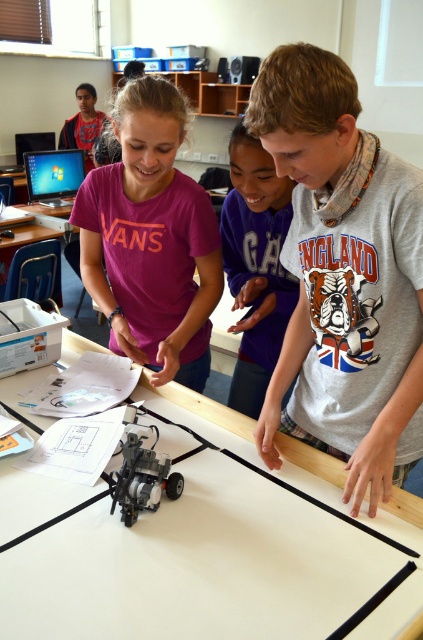
Question: Can you confirm if gray cotton shirt at center is bigger than matte pink shirt at center?

Choices:
 (A) yes
 (B) no

Answer: (B)

Question: Which point is closer to the camera taking this photo?

Choices:
 (A) (239, 284)
 (B) (184, 508)

Answer: (B)

Question: Is white matte table at center to the right of gray cotton shirt at center from the viewer's perspective?

Choices:
 (A) yes
 (B) no

Answer: (B)

Question: Which object is closer to the camera taking this photo?

Choices:
 (A) gray cotton shirt at center
 (B) matte pink shirt at center

Answer: (A)

Question: Which point is farther to the camera?

Choices:
 (A) matte pink shirt at center
 (B) gray cotton shirt at center
 (C) white matte table at center
 (D) white cotton shirt at upper center

Answer: (A)

Question: Can you confirm if white matte table at center is positioned below gray cotton shirt at center?

Choices:
 (A) no
 (B) yes

Answer: (B)